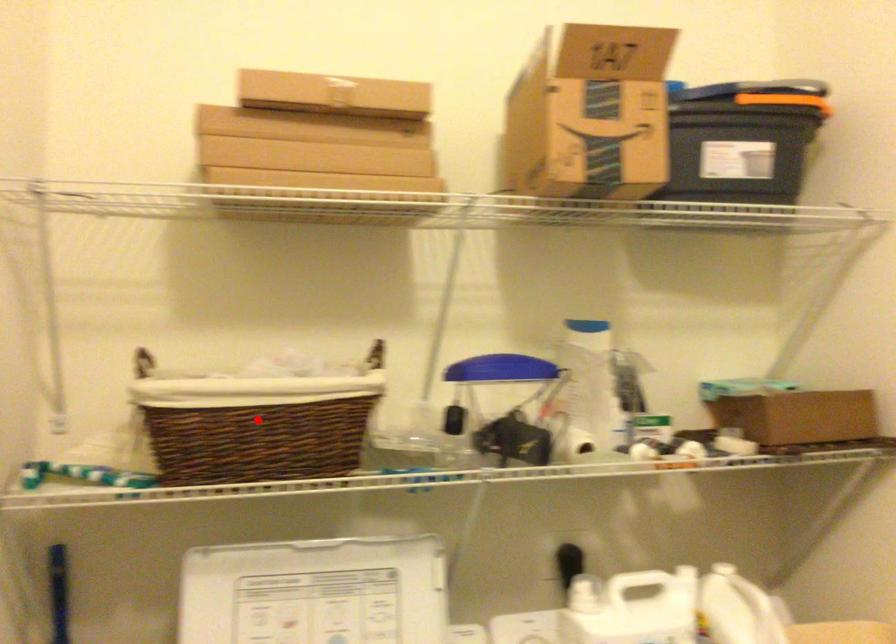
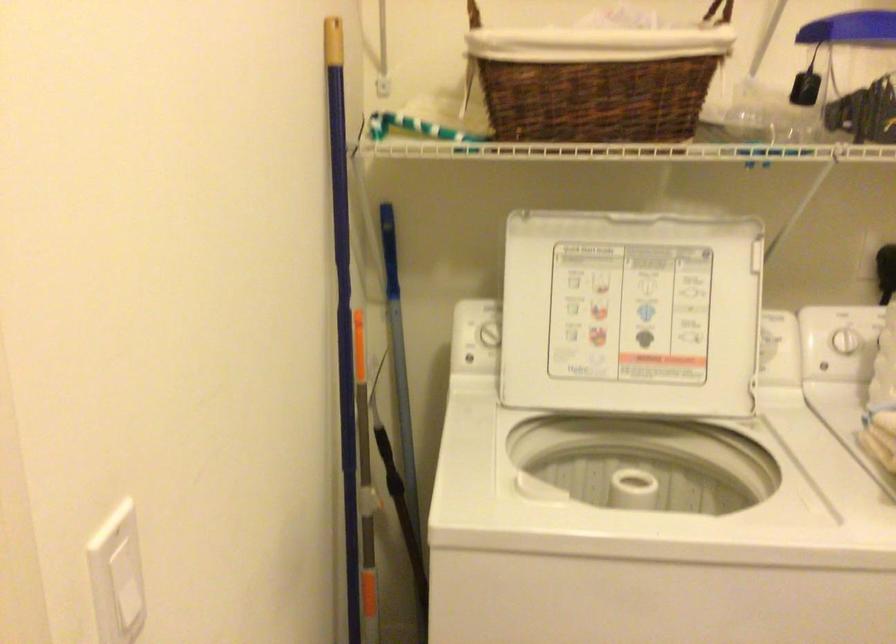
Question: I am providing you with two images of the same scene from different viewpoints. A red point is marked on the first image. Is the red point's position out of view in image 2?

Choices:
 (A) Yes
 (B) No

Answer: (B)